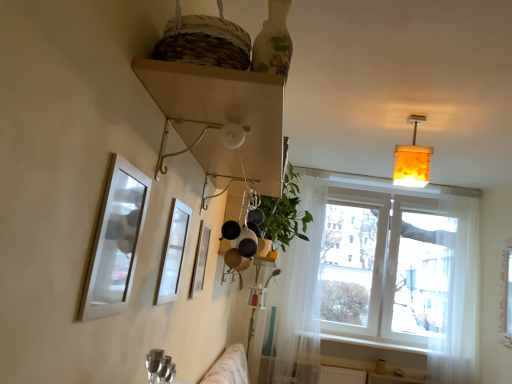
Question: Can you confirm if metallic silver picture frame at center, the third picture frame from the front, is wider than white glossy picture frame at upper center, acting as the 2th picture frame starting from the front?

Choices:
 (A) no
 (B) yes

Answer: (A)

Question: Considering the relative sizes of metallic silver picture frame at center, the 1th picture frame in the back-to-front sequence, and white glossy picture frame at upper center, the second picture frame from the back, in the image provided, is metallic silver picture frame at center, the 1th picture frame in the back-to-front sequence, bigger than white glossy picture frame at upper center, the second picture frame from the back,?

Choices:
 (A) yes
 (B) no

Answer: (B)

Question: Is metallic silver picture frame at center, the 1th picture frame in the back-to-front sequence, shorter than white glossy picture frame at upper center, acting as the 2th picture frame starting from the front?

Choices:
 (A) no
 (B) yes

Answer: (B)

Question: Can you confirm if metallic silver picture frame at center, the 1th picture frame in the back-to-front sequence, is positioned to the right of white glossy picture frame at upper center, acting as the 2th picture frame starting from the front?

Choices:
 (A) yes
 (B) no

Answer: (A)

Question: From a real-world perspective, is metallic silver picture frame at center, the 1th picture frame in the back-to-front sequence, positioned under white glossy picture frame at upper center, acting as the 2th picture frame starting from the front, based on gravity?

Choices:
 (A) yes
 (B) no

Answer: (A)

Question: From their relative heights in the image, would you say white glossy picture frame at upper center, the second picture frame from the back, is taller or shorter than white smooth window sill at lower right?

Choices:
 (A) tall
 (B) short

Answer: (A)

Question: Does point (182, 203) appear closer or farther from the camera than point (338, 342)?

Choices:
 (A) closer
 (B) farther

Answer: (A)

Question: Based on their sizes in the image, would you say white glossy picture frame at upper center, acting as the 2th picture frame starting from the front, is bigger or smaller than white smooth window sill at lower right?

Choices:
 (A) big
 (B) small

Answer: (B)

Question: Looking at their shapes, would you say white glossy picture frame at upper center, the second picture frame from the back, is wider or thinner than white smooth window sill at lower right?

Choices:
 (A) wide
 (B) thin

Answer: (B)

Question: From the image's perspective, is translucent amber glass lampshade at upper right positioned above or below white sheer curtain at right, marked as the second curtain in a left-to-right arrangement?

Choices:
 (A) above
 (B) below

Answer: (A)

Question: From a real-world perspective, is translucent amber glass lampshade at upper right positioned above or below white sheer curtain at right, marked as the second curtain in a left-to-right arrangement?

Choices:
 (A) above
 (B) below

Answer: (A)

Question: Does point (394, 168) appear closer or farther from the camera than point (465, 357)?

Choices:
 (A) closer
 (B) farther

Answer: (A)

Question: Which is correct: translucent amber glass lampshade at upper right is inside white sheer curtain at right, marked as the second curtain in a left-to-right arrangement, or outside of it?

Choices:
 (A) outside
 (B) inside

Answer: (A)

Question: From the image's perspective, relative to wooden shelf at upper center, is translucent amber glass lampshade at upper right above or below?

Choices:
 (A) below
 (B) above

Answer: (B)

Question: Considering the positions of translucent amber glass lampshade at upper right and wooden shelf at upper center in the image, is translucent amber glass lampshade at upper right bigger or smaller than wooden shelf at upper center?

Choices:
 (A) big
 (B) small

Answer: (B)